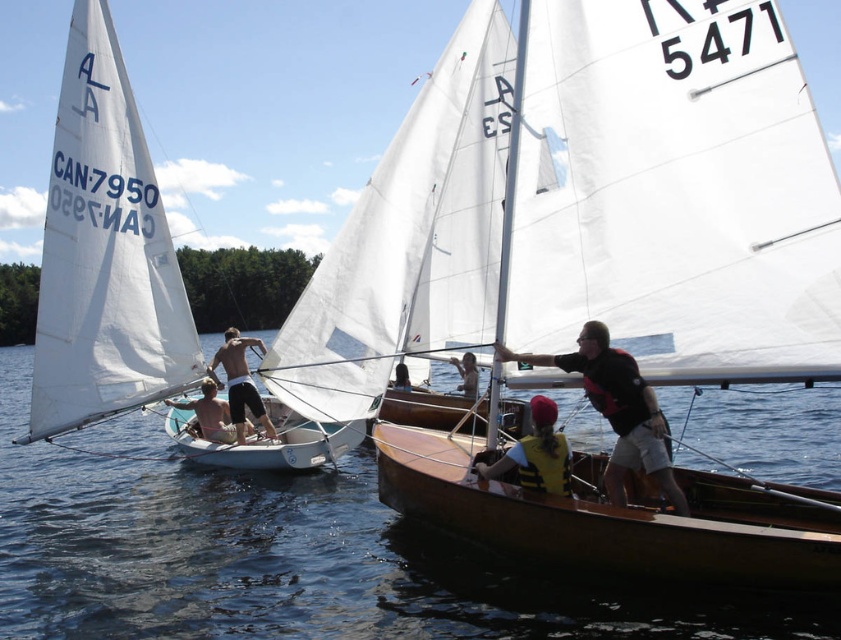
Question: Which point is farther to the camera?

Choices:
 (A) light brown wooden boat at center
 (B) dark blue fabric shirt at center
 (C) brown wood boat at center
 (D) transparent water at center

Answer: (B)

Question: Observing the image, what is the correct spatial positioning of transparent water at center in reference to shiny black shorts at center?

Choices:
 (A) right
 (B) left

Answer: (A)

Question: Which point is closer to the camera?

Choices:
 (A) tan skin man at center
 (B) dark blue fabric shirt at center
 (C) brown wood boat at center

Answer: (C)

Question: Which is farther from the transparent water at center?

Choices:
 (A) brown wood boat at center
 (B) shiny black shorts at center

Answer: (B)

Question: Is transparent water at center positioned behind light brown wooden boat at center?

Choices:
 (A) yes
 (B) no

Answer: (B)

Question: Observing the image, what is the correct spatial positioning of brown wood boat at center in reference to black matte life vest at center?

Choices:
 (A) below
 (B) above

Answer: (A)